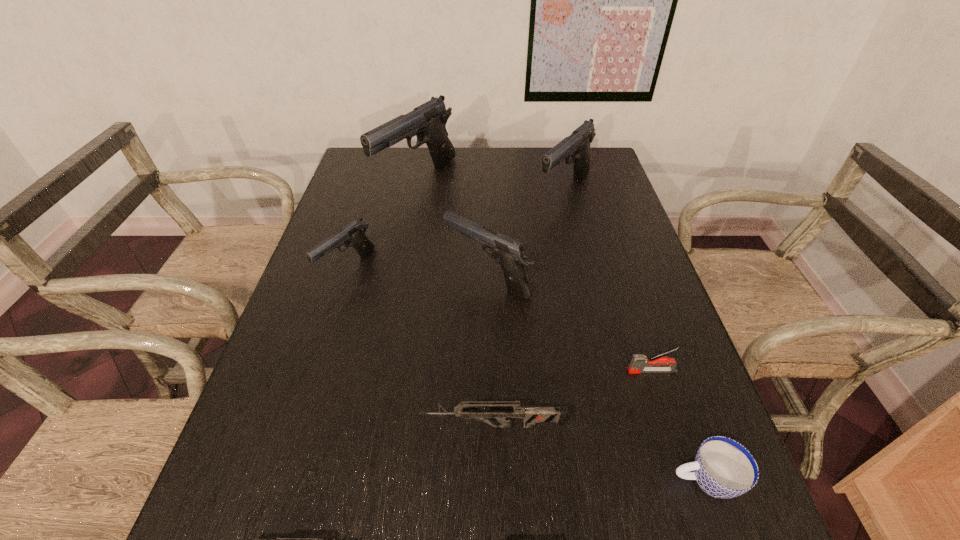
Where is `the tallest object`? the tallest object is located at coordinates (x=428, y=121).

I want to click on the tallest gun, so click(x=428, y=121).

In order to click on the rightmost gun in this screenshot , I will do `click(577, 145)`.

This screenshot has width=960, height=540. Find the location of `the seventh shortest object`. the seventh shortest object is located at coordinates 577,145.

At what (x,y) coordinates should I click in order to perform the action: click on the fourth shortest gun. Please return your answer as a coordinate pair (x, y). The width and height of the screenshot is (960, 540). Looking at the image, I should click on (510, 254).

Identify the location of the third tallest object. (510, 254).

Find the location of a particular element. This screenshot has height=540, width=960. the smallest black gun is located at coordinates [x=353, y=235].

Find the location of `the fourth tallest object`. the fourth tallest object is located at coordinates (353, 235).

Identify the location of the fourth nearest object. (637, 365).

Find the location of a particular element. gray stapler is located at coordinates (637, 365).